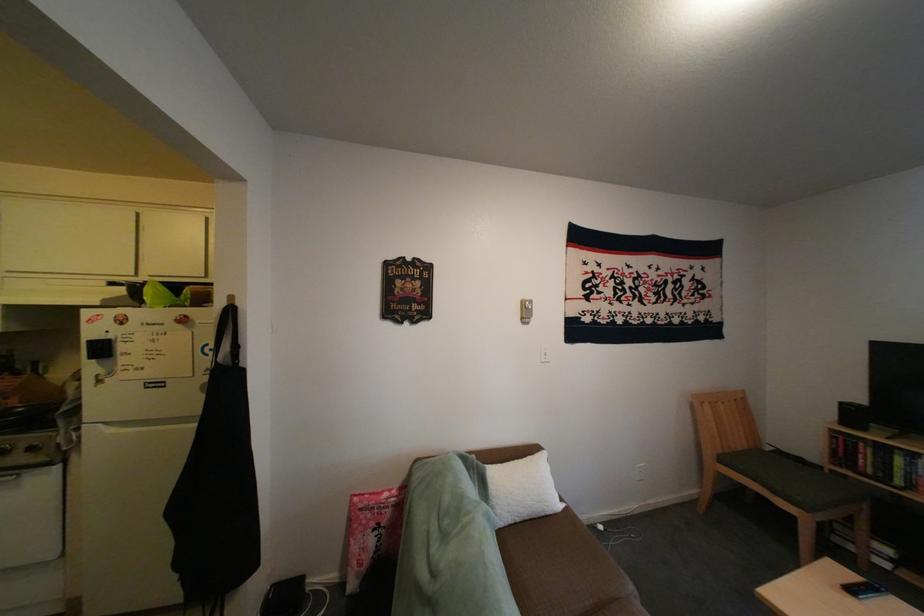
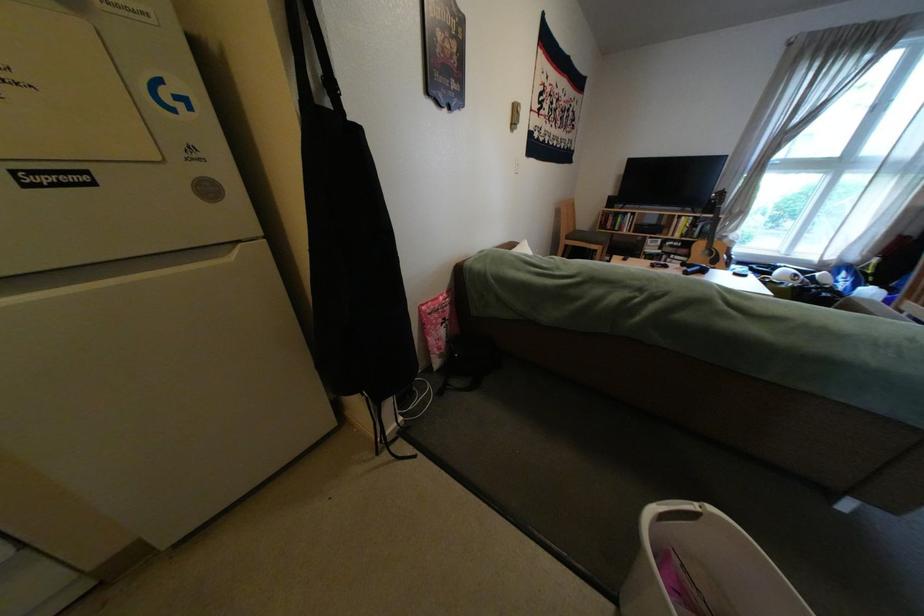
Where in the second image is the point corresponding to (381,504) from the first image?

(446, 309)